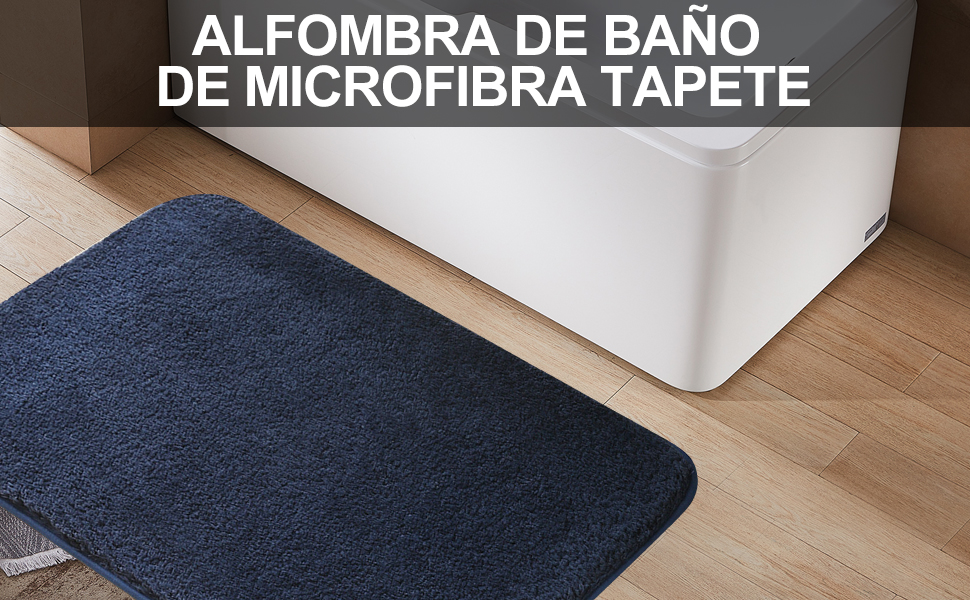
Where is `upper left corner of mat`? The height and width of the screenshot is (600, 970). upper left corner of mat is located at coordinates point(200,194).